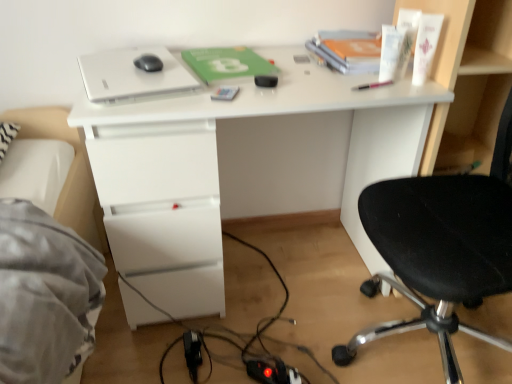
This screenshot has width=512, height=384. I want to click on vacant point to the right of black matte mouse at upper center, so click(x=174, y=67).